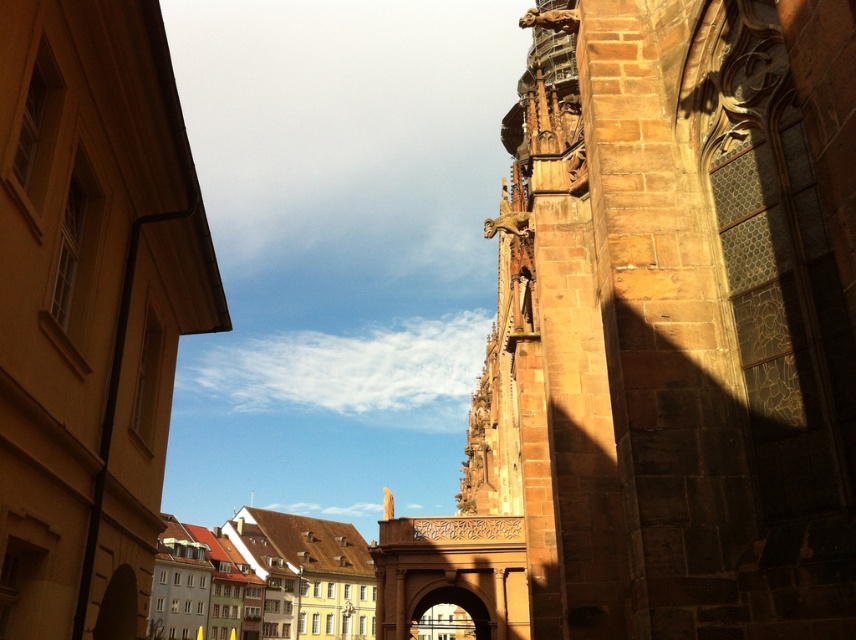
Question: Can you confirm if brown stone church at upper left is positioned below light brown stone buildings at center?

Choices:
 (A) no
 (B) yes

Answer: (A)

Question: In this image, where is brown stone tower at upper right located relative to light brown stone buildings at center?

Choices:
 (A) right
 (B) left

Answer: (A)

Question: Which point is closer to the camera taking this photo?

Choices:
 (A) (798, 550)
 (B) (201, 536)
 (C) (4, 257)

Answer: (A)

Question: Which object is farther from the camera taking this photo?

Choices:
 (A) light brown stone buildings at center
 (B) brown stone church at upper left
 (C) brown stone tower at upper right

Answer: (A)

Question: Among these points, which one is farthest from the camera?

Choices:
 (A) click(x=132, y=589)
 (B) click(x=283, y=620)
 (C) click(x=716, y=180)

Answer: (B)

Question: Does brown stone church at upper left have a larger size compared to light brown stone buildings at center?

Choices:
 (A) no
 (B) yes

Answer: (A)